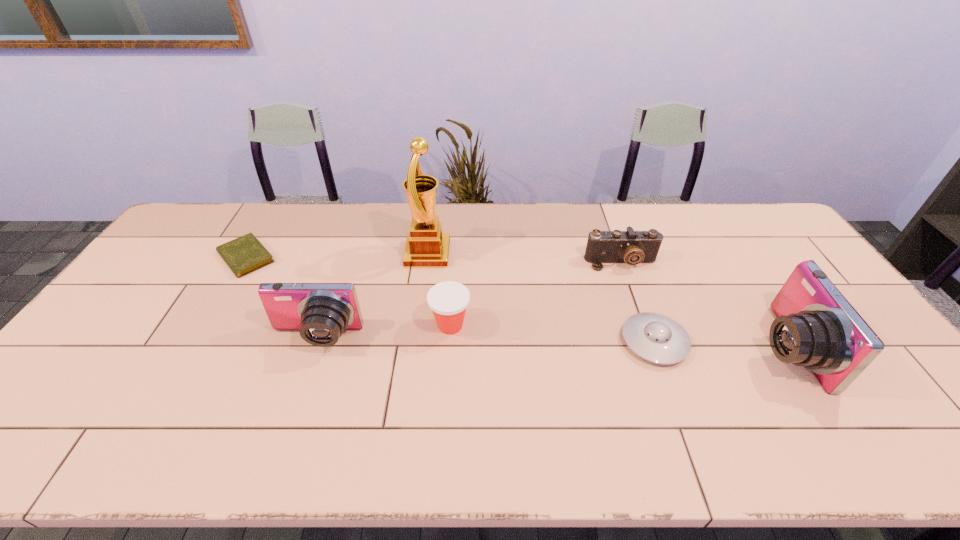
Find the location of a particular element. The width and height of the screenshot is (960, 540). the third tallest object is located at coordinates (321, 312).

This screenshot has height=540, width=960. I want to click on the second tallest camera, so [x=321, y=312].

Locate an element on the screen. the rightmost camera is located at coordinates (816, 327).

The height and width of the screenshot is (540, 960). I want to click on the tallest camera, so click(816, 327).

Find the location of a particular element. the shortest object is located at coordinates (243, 255).

Where is `diary`? Image resolution: width=960 pixels, height=540 pixels. diary is located at coordinates (243, 255).

The height and width of the screenshot is (540, 960). Find the location of `the shortest camera`. the shortest camera is located at coordinates (632, 247).

Where is `the second camera from left to right`? The width and height of the screenshot is (960, 540). the second camera from left to right is located at coordinates click(632, 247).

Find the location of `award`. award is located at coordinates (426, 246).

This screenshot has width=960, height=540. I want to click on Dixie cup, so (x=448, y=300).